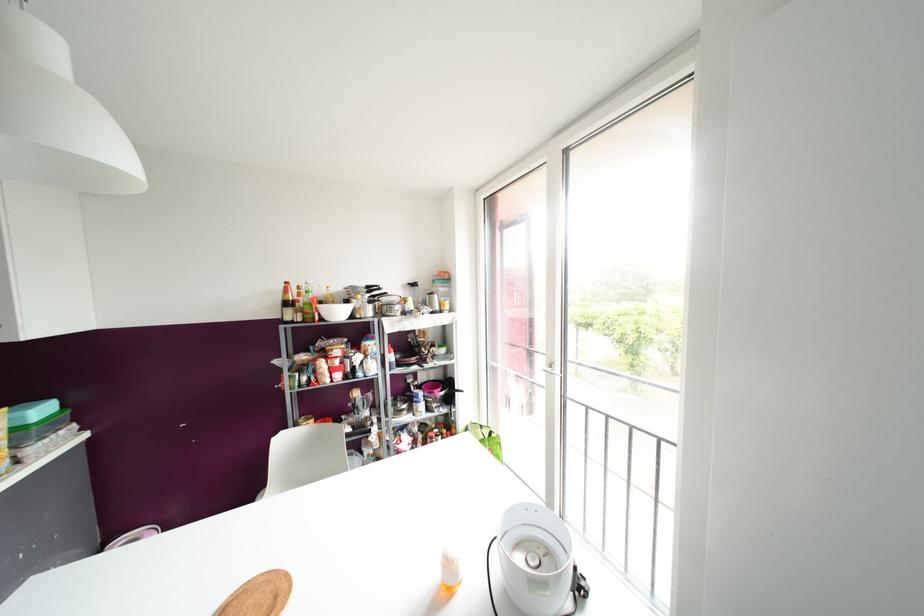
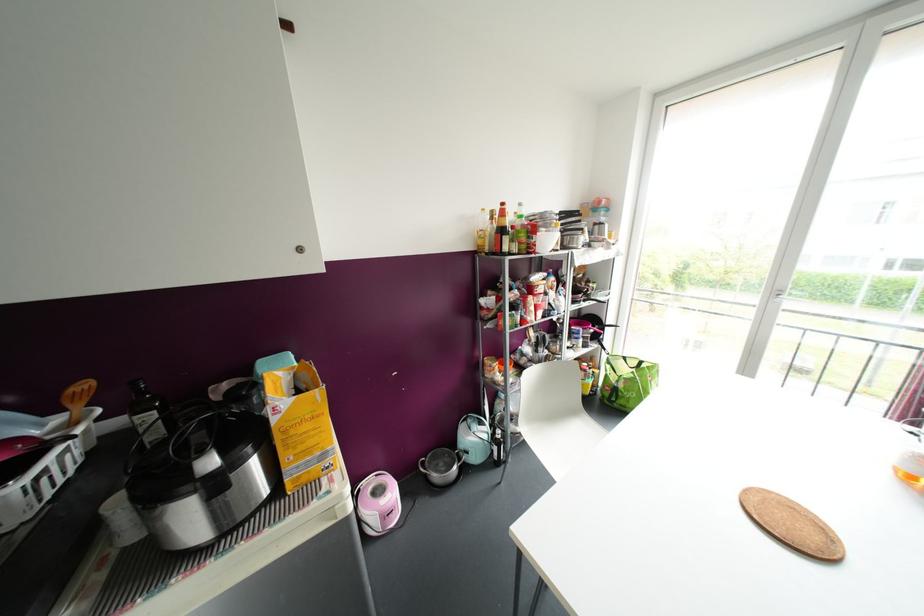
Where in the second image is the point corresponding to the point at 480,426 from the first image?

(624, 358)